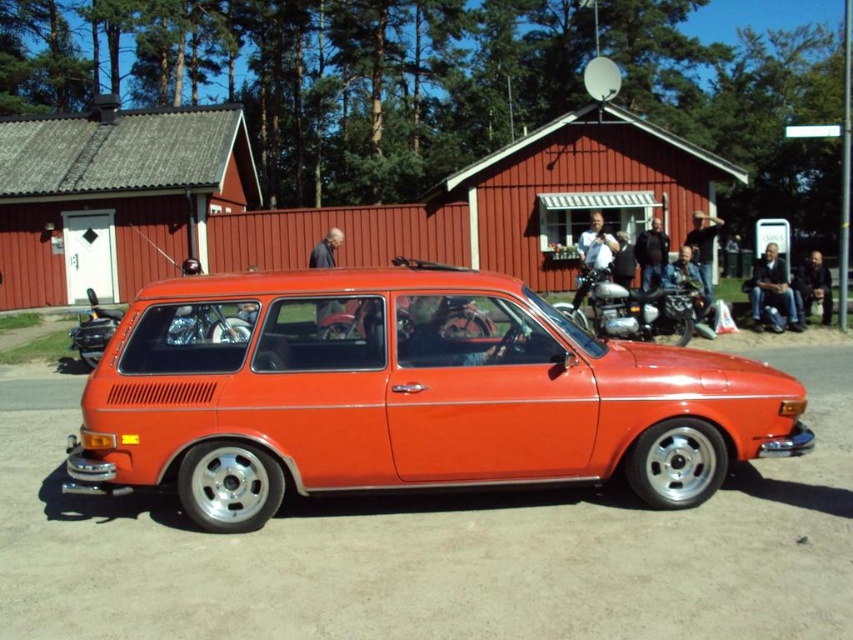
Question: Can you confirm if shiny chrome motorcycle at rear is positioned below black leather jacket at center?

Choices:
 (A) yes
 (B) no

Answer: (A)

Question: Does glossy orange station wagon at center come behind shiny chrome motorcycle at rear?

Choices:
 (A) no
 (B) yes

Answer: (A)

Question: Is shiny chrome motorcycle at center below leather jacket at right?

Choices:
 (A) no
 (B) yes

Answer: (B)

Question: Which object appears farthest from the camera in this image?

Choices:
 (A) dark gray fabric jacket at lower right
 (B) jeans at center

Answer: (A)

Question: Estimate the real-world distances between objects in this image. Which object is farther from the dark blue jeans at right?

Choices:
 (A) jeans at center
 (B) leather jacket at right
 (C) dark blue fabric jacket at center
 (D) black leather jacket at center

Answer: (C)

Question: Which of these objects is positioned closest to the dark blue fabric jacket at center?

Choices:
 (A) matte black jacket at center
 (B) dark gray fabric jacket at lower right
 (C) shiny chrome motorcycle at center
 (D) leather jacket at right

Answer: (C)